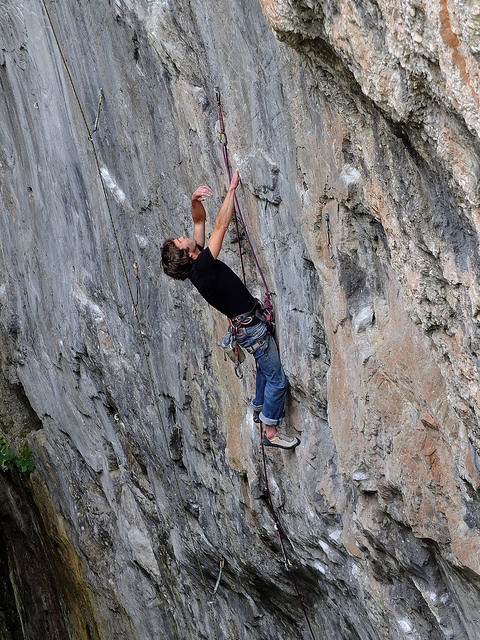
Identify the location of plant. The width and height of the screenshot is (480, 640). (22, 461).